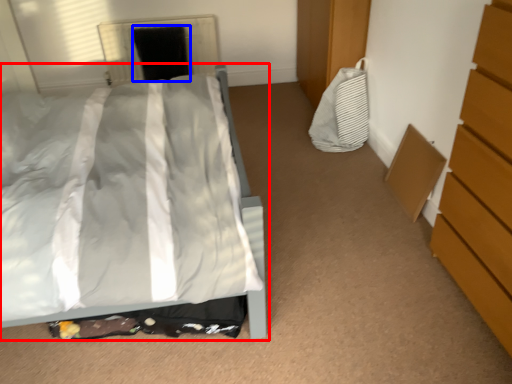
Question: Among these objects, which one is nearest to the camera, bed (highlighted by a red box) or screen door (highlighted by a blue box)?

Choices:
 (A) bed
 (B) screen door

Answer: (A)